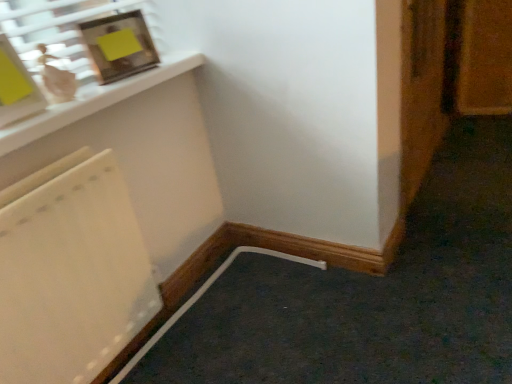
Question: In the image, is wooden door at right positioned in front of or behind metallic silver picture frame at upper left?

Choices:
 (A) behind
 (B) front

Answer: (A)

Question: From the image's perspective, is wooden door at right above or below metallic silver picture frame at upper left?

Choices:
 (A) above
 (B) below

Answer: (A)

Question: From their relative heights in the image, would you say wooden door at right is taller or shorter than metallic silver picture frame at upper left?

Choices:
 (A) short
 (B) tall

Answer: (B)

Question: Visually, is metallic silver picture frame at upper left positioned to the left or to the right of wooden door at right?

Choices:
 (A) right
 (B) left

Answer: (B)

Question: Is point (144, 41) positioned closer to the camera than point (441, 31)?

Choices:
 (A) closer
 (B) farther

Answer: (A)

Question: From the image's perspective, is metallic silver picture frame at upper left positioned above or below wooden door at right?

Choices:
 (A) below
 (B) above

Answer: (A)

Question: Looking at the image, does metallic silver picture frame at upper left seem bigger or smaller compared to wooden door at right?

Choices:
 (A) small
 (B) big

Answer: (A)